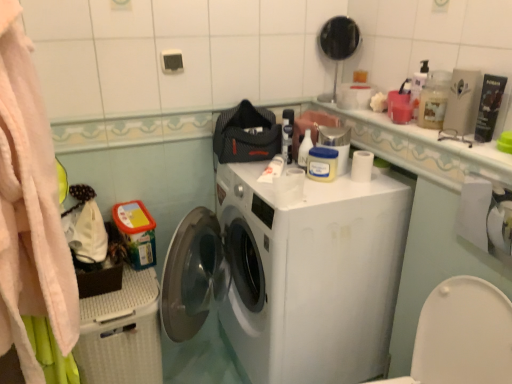
Question: Which direction should I rotate to look at white glossy bottle at upper center, marked as the first cleaning product in a back-to-front arrangement, — up or down?

Choices:
 (A) down
 (B) up

Answer: (B)

Question: Can you confirm if translucent plastic bottle at upper right, which is the first cleaning product in right-to-left order, is thinner than white glossy countertop at upper right?

Choices:
 (A) no
 (B) yes

Answer: (A)

Question: Considering the relative positions of translucent plastic bottle at upper right, acting as the 2th cleaning product starting from the left, and white glossy countertop at upper right in the image provided, is translucent plastic bottle at upper right, acting as the 2th cleaning product starting from the left, in front of white glossy countertop at upper right?

Choices:
 (A) no
 (B) yes

Answer: (A)

Question: Is translucent plastic bottle at upper right, the 2th cleaning product when ordered from back to front, facing towards white glossy countertop at upper right?

Choices:
 (A) no
 (B) yes

Answer: (A)

Question: Is translucent plastic bottle at upper right, which is the first cleaning product in right-to-left order, outside of white glossy countertop at upper right?

Choices:
 (A) yes
 (B) no

Answer: (A)

Question: Is translucent plastic bottle at upper right, the 2th cleaning product when ordered from back to front, directly adjacent to white glossy countertop at upper right?

Choices:
 (A) yes
 (B) no

Answer: (B)

Question: From a real-world perspective, is translucent plastic bottle at upper right, acting as the 2th cleaning product starting from the left, positioned under white glossy countertop at upper right based on gravity?

Choices:
 (A) yes
 (B) no

Answer: (B)

Question: From the image's perspective, is metallic silver container at upper right below soft pink towel at left?

Choices:
 (A) no
 (B) yes

Answer: (A)

Question: Is soft pink towel at left at the back of metallic silver container at upper right?

Choices:
 (A) yes
 (B) no

Answer: (B)

Question: Is metallic silver container at upper right positioned behind soft pink towel at left?

Choices:
 (A) yes
 (B) no

Answer: (A)

Question: Can soft pink towel at left be found inside metallic silver container at upper right?

Choices:
 (A) yes
 (B) no

Answer: (B)

Question: Are metallic silver container at upper right and soft pink towel at left far apart?

Choices:
 (A) no
 (B) yes

Answer: (A)

Question: Is metallic silver container at upper right closer to the viewer compared to soft pink towel at left?

Choices:
 (A) no
 (B) yes

Answer: (A)

Question: Considering the relative positions of matte black mirror at upper center and white glossy countertop at upper right in the image provided, is matte black mirror at upper center to the left of white glossy countertop at upper right from the viewer's perspective?

Choices:
 (A) no
 (B) yes

Answer: (B)